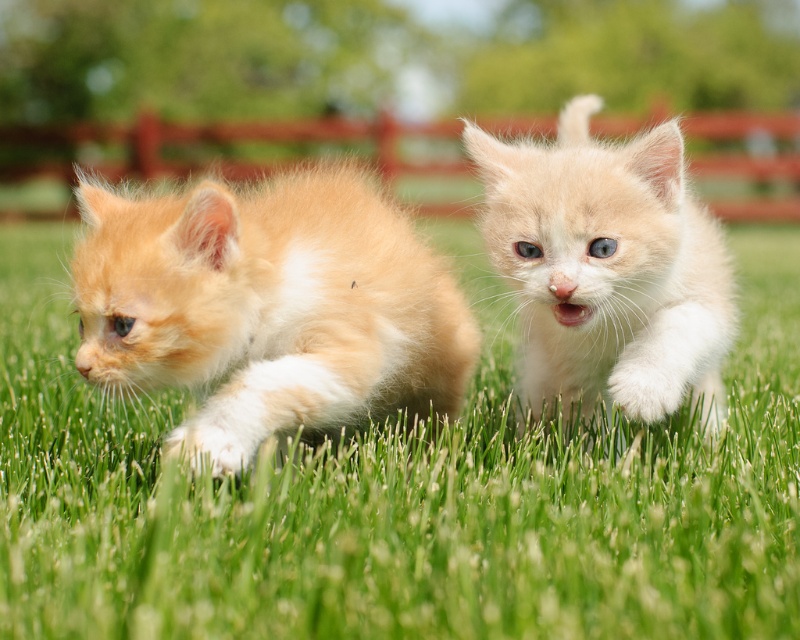
You are a photographer trying to capture a closeup of the fluffy orange kitten at center. Since the green grassy at center is in the way, can you determine if you can lower your camera to get the shot without the grass blocking the view?

The green grassy at center is not as tall as the fluffy orange kitten at center, so yes, you can lower your camera to get a clear shot of the fluffy orange kitten at center without the grass blocking the view.

You are a cat photographer trying to capture both kittens in a single shot. You notice that one kitten is positioned at point (8, 413) and the other at point (184, 365). Based on their positions, which kitten is farther away from the camera?

Point (8, 413) is behind point (184, 365), so the kitten at point (8, 413) is farther away from the camera.